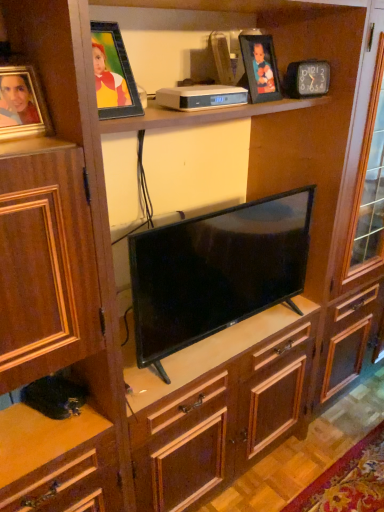
Question: Relative to black glossy tv at center, is matte black picture frame at upper center, marked as the 2th picture frame in a bottom-to-top arrangement, in front or behind?

Choices:
 (A) front
 (B) behind

Answer: (B)

Question: Is matte black picture frame at upper center, arranged as the first picture frame when viewed from the top, to the left or to the right of black glossy tv at center in the image?

Choices:
 (A) right
 (B) left

Answer: (A)

Question: Estimate the real-world distances between objects in this image. Which object is farther from the matte gold picture frame at left, which is counted as the first picture frame, starting from the front?

Choices:
 (A) black glossy tv at center
 (B) matte black picture frame at upper center, the second picture frame viewed from the front

Answer: (B)

Question: Considering the real-world distances, which object is farthest from the matte gold picture frame at left, positioned as the second picture frame in back-to-front order?

Choices:
 (A) matte black picture frame at upper center, the second picture frame viewed from the front
 (B) black glossy tv at center

Answer: (A)